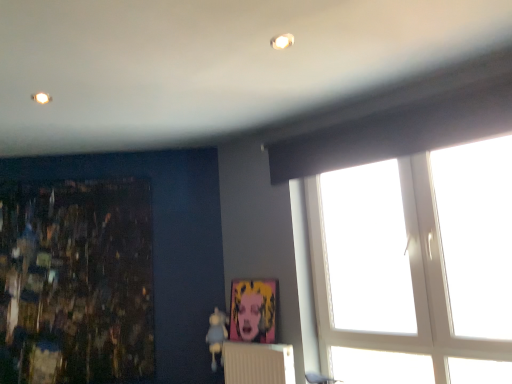
Question: Would you say white textured radiator at lower center is inside or outside matte plastic picture frame at center?

Choices:
 (A) inside
 (B) outside

Answer: (B)

Question: From a real-world perspective, relative to matte plastic picture frame at center, is white textured radiator at lower center vertically above or below?

Choices:
 (A) above
 (B) below

Answer: (B)

Question: Estimate the real-world distances between objects in this image. Which object is farther from the white plastic window at upper right?

Choices:
 (A) white textured radiator at lower center
 (B) dark textured painting at left
 (C) matte plastic picture frame at center

Answer: (A)

Question: Which of these objects is positioned closest to the dark textured painting at left?

Choices:
 (A) white textured radiator at lower center
 (B) matte plastic picture frame at center
 (C) white plastic window at upper right

Answer: (B)